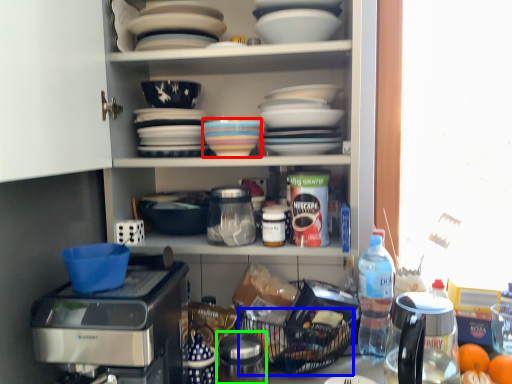
Question: Estimate the real-world distances between objects in this image. Which object is farther from tableware (highlighted by a red box), basket (highlighted by a blue box) or appliance (highlighted by a green box)?

Choices:
 (A) basket
 (B) appliance

Answer: (B)